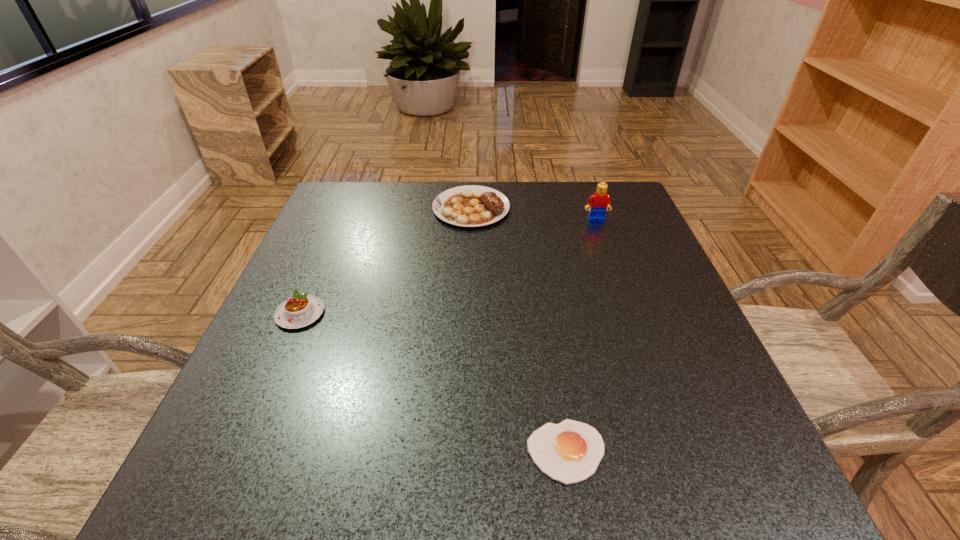
Where is `free space located on the back of the shortest object`? The width and height of the screenshot is (960, 540). free space located on the back of the shortest object is located at coordinates (546, 321).

You are a GUI agent. You are given a task and a screenshot of the screen. Output one action in this format:
    pyautogui.click(x=<x>, y=<y>)
    Task: Click on the Lego located in the far edge section of the desktop
    
    Given the screenshot: What is the action you would take?
    pyautogui.click(x=600, y=201)

At what (x,y) coordinates should I click in order to perform the action: click on steak that is at the far edge. Please return your answer as a coordinate pair (x, y). Looking at the image, I should click on (469, 206).

What are the coordinates of `object situated at the near edge` in the screenshot? It's located at click(569, 452).

I want to click on object present at the left edge, so click(x=298, y=311).

Image resolution: width=960 pixels, height=540 pixels. What are the coordinates of `object positioned at the right edge` in the screenshot? It's located at (600, 201).

You are a GUI agent. You are given a task and a screenshot of the screen. Output one action in this format:
    pyautogui.click(x=<x>, y=<y>)
    Task: Click on the object located at the far right corner
    
    Given the screenshot: What is the action you would take?
    pyautogui.click(x=600, y=201)

Identify the location of free space at the far edge. (414, 225).

This screenshot has width=960, height=540. What are the coordinates of `blank space at the near edge` in the screenshot? It's located at (311, 472).

Locate an element on the screen. This screenshot has height=540, width=960. vacant region at the left edge of the desktop is located at coordinates (329, 251).